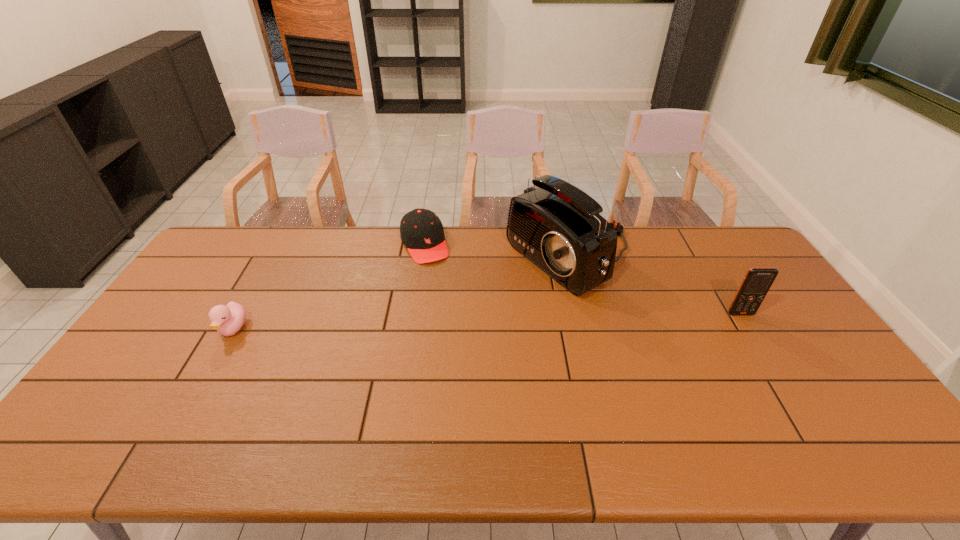
What are the coordinates of `vacant space at the right edge of the desktop` in the screenshot? It's located at (832, 362).

This screenshot has width=960, height=540. I want to click on vacant space at the near right corner of the desktop, so click(828, 393).

Where is `vacant region between the duckling and the rightmost object`? This screenshot has width=960, height=540. vacant region between the duckling and the rightmost object is located at coordinates [x=487, y=321].

Find the location of a particular element. Image resolution: width=960 pixels, height=540 pixels. free space that is in between the leftmost object and the cellular telephone is located at coordinates (487, 321).

At what (x,y) coordinates should I click in order to perform the action: click on vacant region between the rightmost object and the duckling. Please return your answer as a coordinate pair (x, y). Looking at the image, I should click on (487, 321).

Locate an element on the screen. The image size is (960, 540). vacant region between the leftmost object and the third object from right to left is located at coordinates (329, 287).

Locate an element on the screen. This screenshot has width=960, height=540. free spot between the duckling and the third object from left to right is located at coordinates click(x=402, y=295).

Locate an element on the screen. The width and height of the screenshot is (960, 540). vacant space in between the third object from left to right and the rightmost object is located at coordinates (656, 287).

Find the location of a particular element. The image size is (960, 540). vacant area between the third shortest object and the leftmost object is located at coordinates (487, 321).

Choose which object is the second nearest neighbor to the radio receiver. Please provide its 2D coordinates. Your answer should be formatted as a tuple, i.e. [(x, y)], where the tuple contains the x and y coordinates of a point satisfying the conditions above.

[(757, 281)]